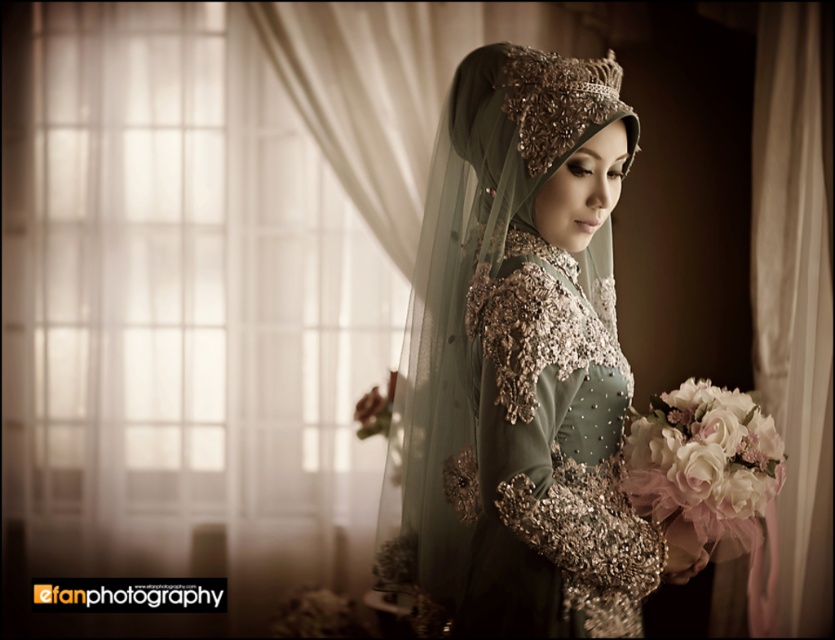
Question: Among these points, which one is farthest from the camera?

Choices:
 (A) (792, 413)
 (B) (694, 500)
 (C) (591, 104)

Answer: (A)

Question: Which point appears farthest from the camera in this image?

Choices:
 (A) [x=697, y=404]
 (B) [x=778, y=528]
 (C) [x=600, y=406]
 (D) [x=512, y=445]

Answer: (B)

Question: Does white sheer curtain at right appear on the left side of white fabric bouquet at lower right?

Choices:
 (A) yes
 (B) no

Answer: (B)

Question: Is satin green dress at center wider than white sheer curtain at right?

Choices:
 (A) yes
 (B) no

Answer: (A)

Question: Which point is closer to the camera?

Choices:
 (A) (816, 284)
 (B) (486, 524)

Answer: (B)

Question: Can you confirm if white sheer curtain at right is positioned above white fabric bouquet at lower right?

Choices:
 (A) no
 (B) yes

Answer: (B)